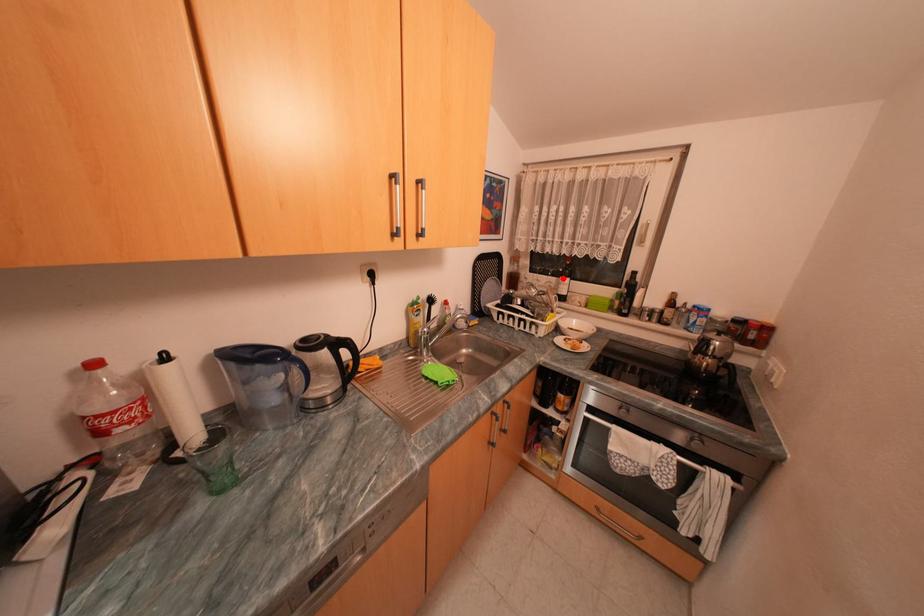
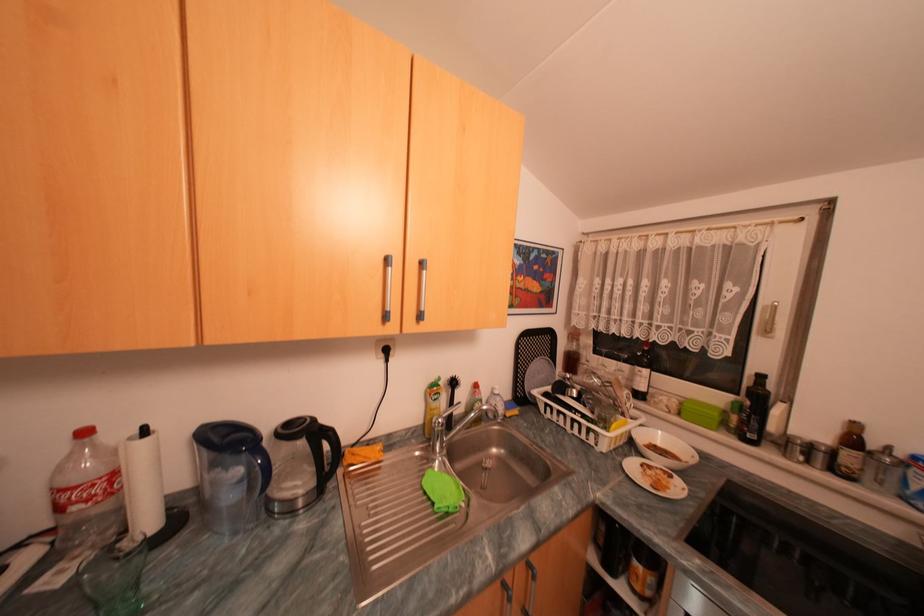
The point at the highlighted location is marked in the first image. Where is the corresponding point in the second image?

(636, 366)